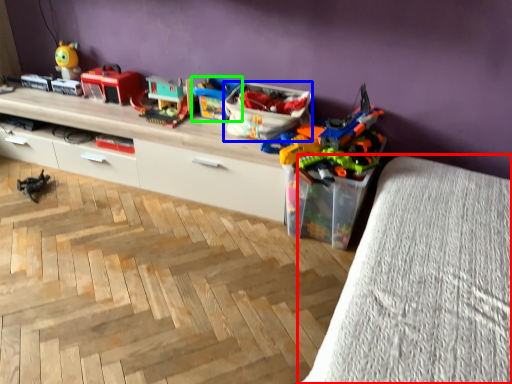
Question: Which object is the farthest from furniture (highlighted by a red box)? Choose among these: storage box (highlighted by a blue box) or toy (highlighted by a green box).

Choices:
 (A) storage box
 (B) toy

Answer: (B)